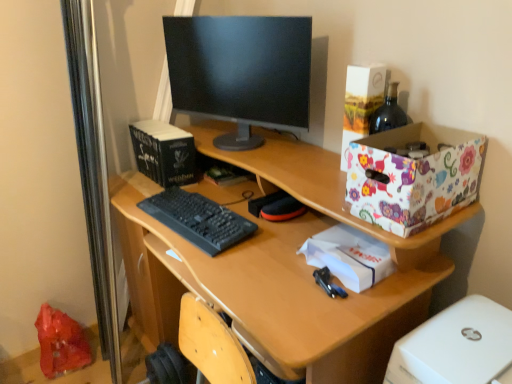
What are the coordinates of `vacant space behind floral paper box at upper right` in the screenshot? It's located at (321, 155).